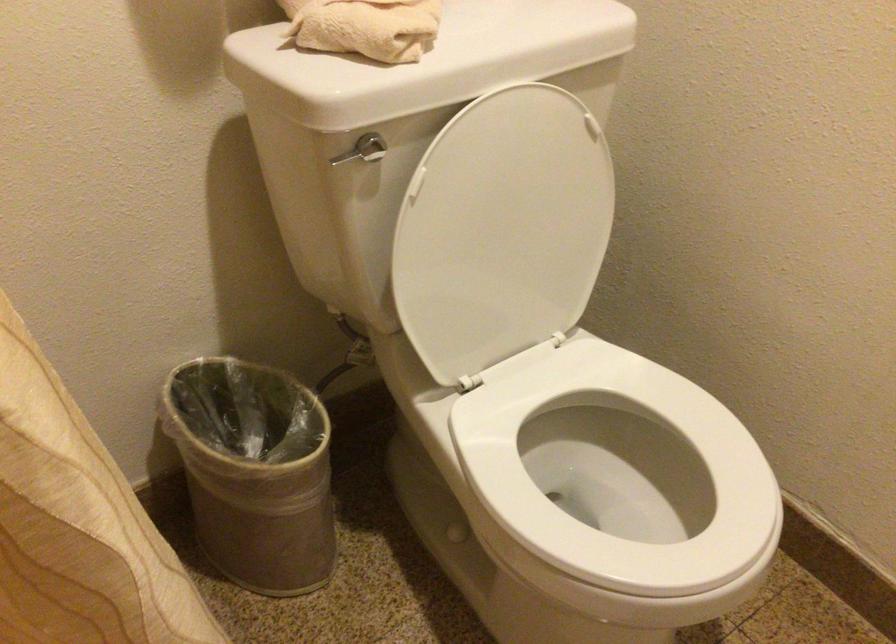
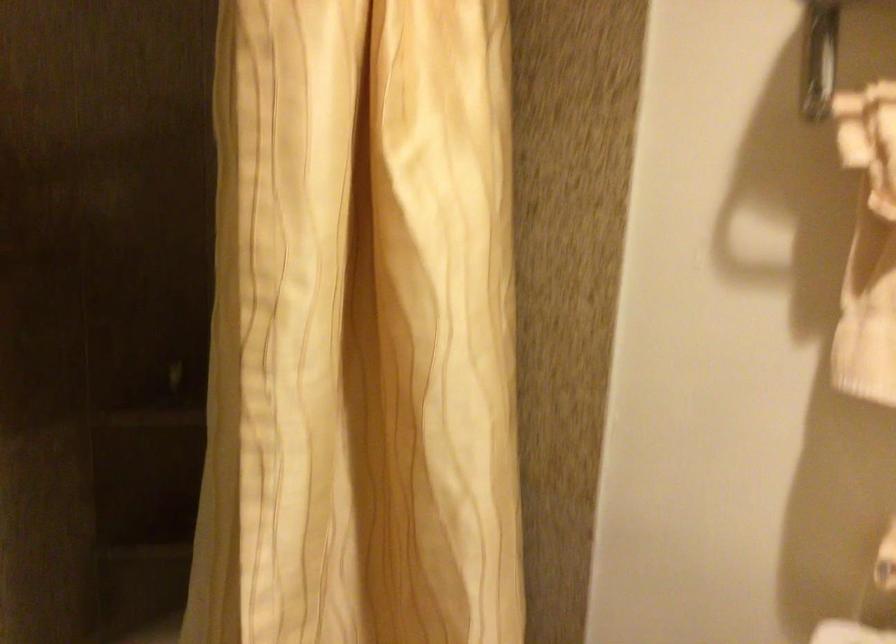
Question: Based on the continuous images, in which direction is the camera rotating? Reply with the corresponding letter.

Choices:
 (A) Left
 (B) Right
 (C) Up
 (D) Down

Answer: (A)